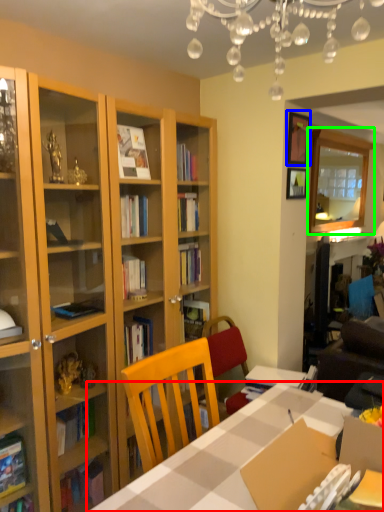
Question: Based on their relative distances, which object is nearer to table (highlighted by a red box)? Choose from picture frame (highlighted by a blue box) and glass door (highlighted by a green box).

Choices:
 (A) picture frame
 (B) glass door

Answer: (A)